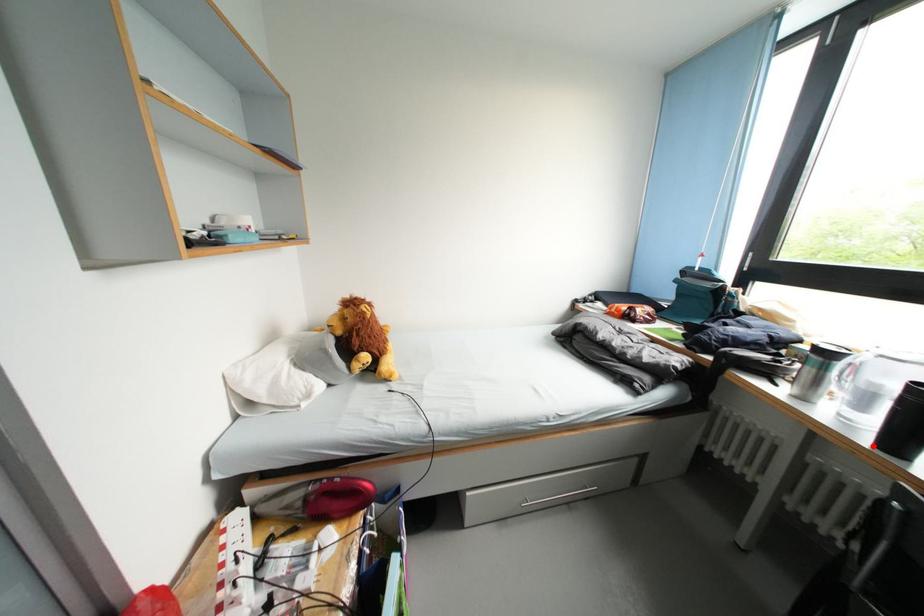
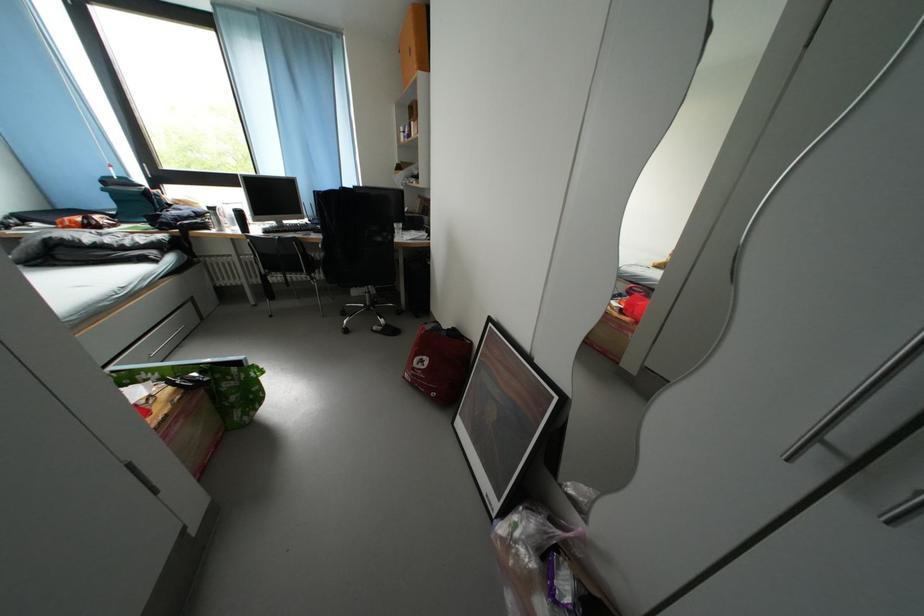
Find the pixel in the second image that matches the highlighted location in the first image.

(248, 238)